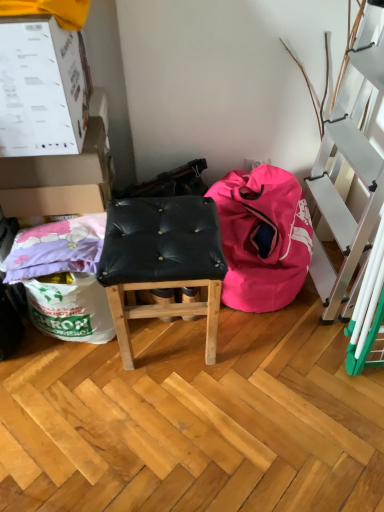
Image resolution: width=384 pixels, height=512 pixels. In order to click on white cardboard box at upper left, the 2th box viewed from the front in this screenshot , I will do `click(58, 180)`.

The height and width of the screenshot is (512, 384). What are the coordinates of `white cardboard box at upper left, the 2th box when ordered from back to front` in the screenshot? It's located at (42, 88).

What do you see at coordinates (262, 237) in the screenshot?
I see `pink fabric bean bag at lower right` at bounding box center [262, 237].

Locate an element on the screen. This screenshot has width=384, height=512. white cardboard box at upper left, the 2th box viewed from the front is located at coordinates (58, 180).

Is pink fabric bean bag at lower right touching white cardboard box at upper left, the 1th box from the back?

pink fabric bean bag at lower right and white cardboard box at upper left, the 1th box from the back, are clearly separated.

Which object is positioned more to the right, pink fabric bean bag at lower right or white cardboard box at upper left, the 2th box viewed from the front?

pink fabric bean bag at lower right.

Who is smaller, pink fabric bean bag at lower right or white cardboard box at upper left, the 2th box viewed from the front?

Smaller between the two is white cardboard box at upper left, the 2th box viewed from the front.

Could you tell me if pink fabric bean bag at lower right is facing white cardboard box at upper left, the 2th box viewed from the front?

No, pink fabric bean bag at lower right is not facing towards white cardboard box at upper left, the 2th box viewed from the front.

Considering the positions of points (52, 162) and (170, 265), is point (52, 162) closer to camera compared to point (170, 265)?

No.

Identify the location of the 1st box counting from the left of the black leather stool at center. (58, 180).

Between white cardboard box at upper left, the 2th box viewed from the front, and black leather stool at center, which one has more height?

With more height is black leather stool at center.

How different are the orientations of white cardboard box at upper left, the 2th box viewed from the front, and black leather stool at center in degrees?

1.64 degrees.

Where is `box that is the 1st object to the left of the pink fabric bean bag at lower right, starting at the anchor`? box that is the 1st object to the left of the pink fabric bean bag at lower right, starting at the anchor is located at coordinates (58, 180).

Would you say white cardboard box at upper left, the 1th box from the back, is outside pink fabric bean bag at lower right?

Absolutely, white cardboard box at upper left, the 1th box from the back, is external to pink fabric bean bag at lower right.

Considering the positions of point (43, 204) and point (233, 274), is point (43, 204) closer or farther from the camera than point (233, 274)?

Point (43, 204) is positioned closer to the camera compared to point (233, 274).

Are white cardboard box at upper left, the 1th box from the back, and pink fabric bean bag at lower right far apart?

No, there isn't a large distance between white cardboard box at upper left, the 1th box from the back, and pink fabric bean bag at lower right.

Is black leather stool at center positioned beyond the bounds of white cardboard box at upper left, the 2th box when ordered from back to front?

Yes, black leather stool at center is outside of white cardboard box at upper left, the 2th box when ordered from back to front.

Considering the points (170, 266) and (64, 130), which point is in front, point (170, 266) or point (64, 130)?

Point (170, 266)

Is black leather stool at center in front of or behind white cardboard box at upper left, placed as the first box when sorted from front to back, in the image?

Clearly, black leather stool at center is behind white cardboard box at upper left, placed as the first box when sorted from front to back.

Is black leather stool at center at the left side of white cardboard box at upper left, the 2th box when ordered from back to front?

No, black leather stool at center is not to the left of white cardboard box at upper left, the 2th box when ordered from back to front.

Measure the distance between pink fabric bean bag at lower right and black leather stool at center.

They are 30.63 centimeters apart.

Is pink fabric bean bag at lower right thinner than black leather stool at center?

No, pink fabric bean bag at lower right is not thinner than black leather stool at center.

Is pink fabric bean bag at lower right touching black leather stool at center?

There is a gap between pink fabric bean bag at lower right and black leather stool at center.

Is pink fabric bean bag at lower right taller or shorter than black leather stool at center?

pink fabric bean bag at lower right is shorter than black leather stool at center.

Does black leather stool at center turn towards white cardboard box at upper left, the 1th box from the back?

No, black leather stool at center is not aimed at white cardboard box at upper left, the 1th box from the back.

Could you measure the distance between black leather stool at center and white cardboard box at upper left, the 1th box from the back?

12.35 inches.

Is black leather stool at center shorter than white cardboard box at upper left, the 1th box from the back?

No.

From the image's perspective, which is below, black leather stool at center or white cardboard box at upper left, the 1th box from the back?

black leather stool at center, from the image's perspective.

Would you say white cardboard box at upper left, placed as the first box when sorted from front to back, is to the left or to the right of white cardboard box at upper left, the 1th box from the back, in the picture?

In the image, white cardboard box at upper left, placed as the first box when sorted from front to back, appears on the left side of white cardboard box at upper left, the 1th box from the back.

Is white cardboard box at upper left, placed as the first box when sorted from front to back, turned away from white cardboard box at upper left, the 2th box viewed from the front?

No, white cardboard box at upper left, placed as the first box when sorted from front to back, is not facing the opposite direction of white cardboard box at upper left, the 2th box viewed from the front.

Does white cardboard box at upper left, the 2th box when ordered from back to front, have a larger size compared to white cardboard box at upper left, the 2th box viewed from the front?

Correct, white cardboard box at upper left, the 2th box when ordered from back to front, is larger in size than white cardboard box at upper left, the 2th box viewed from the front.

Considering the relative sizes of white cardboard box at upper left, placed as the first box when sorted from front to back, and white cardboard box at upper left, the 1th box from the back, in the image provided, is white cardboard box at upper left, placed as the first box when sorted from front to back, thinner than white cardboard box at upper left, the 1th box from the back,?

In fact, white cardboard box at upper left, placed as the first box when sorted from front to back, might be wider than white cardboard box at upper left, the 1th box from the back.

Identify the location of bean bag chair beneath the white cardboard box at upper left, the 2th box viewed from the front (from a real-world perspective). (262, 237).

From the black leather stool at center, count the 1st box to the left and point to it. Please provide its 2D coordinates.

[(58, 180)]

When comparing their distances from white cardboard box at upper left, the 1th box from the back, does white cardboard box at upper left, placed as the first box when sorted from front to back, or pink fabric bean bag at lower right seem closer?

The object closer to white cardboard box at upper left, the 1th box from the back, is white cardboard box at upper left, placed as the first box when sorted from front to back.

Based on their spatial positions, is white cardboard box at upper left, the 2th box when ordered from back to front, or black leather stool at center closer to pink fabric bean bag at lower right?

The object closer to pink fabric bean bag at lower right is black leather stool at center.

When comparing their distances from black leather stool at center, does white cardboard box at upper left, the 2th box when ordered from back to front, or white cardboard box at upper left, the 2th box viewed from the front, seem closer?

white cardboard box at upper left, the 2th box viewed from the front, is positioned closer to the anchor black leather stool at center.

From the image, which object appears to be nearer to black leather stool at center, pink fabric bean bag at lower right or white cardboard box at upper left, the 2th box when ordered from back to front?

pink fabric bean bag at lower right is positioned closer to the anchor black leather stool at center.

When comparing their distances from pink fabric bean bag at lower right, does white cardboard box at upper left, the 2th box viewed from the front, or white cardboard box at upper left, the 2th box when ordered from back to front, seem closer?

Based on the image, white cardboard box at upper left, the 2th box viewed from the front, appears to be nearer to pink fabric bean bag at lower right.

When comparing their distances from black leather stool at center, does white cardboard box at upper left, the 1th box from the back, or pink fabric bean bag at lower right seem closer?

pink fabric bean bag at lower right is closer to black leather stool at center.

From the image, which object appears to be farther from white cardboard box at upper left, the 1th box from the back, pink fabric bean bag at lower right or white cardboard box at upper left, placed as the first box when sorted from front to back?

pink fabric bean bag at lower right.

Based on their spatial positions, is white cardboard box at upper left, the 2th box when ordered from back to front, or pink fabric bean bag at lower right further from black leather stool at center?

The object further to black leather stool at center is white cardboard box at upper left, the 2th box when ordered from back to front.

The height and width of the screenshot is (512, 384). What are the coordinates of `stool located between white cardboard box at upper left, the 2th box viewed from the front, and pink fabric bean bag at lower right in the left-right direction` in the screenshot? It's located at (162, 260).

Identify the location of box situated between white cardboard box at upper left, the 2th box when ordered from back to front, and pink fabric bean bag at lower right from left to right. The height and width of the screenshot is (512, 384). (58, 180).

The height and width of the screenshot is (512, 384). What are the coordinates of `stool between white cardboard box at upper left, placed as the first box when sorted from front to back, and pink fabric bean bag at lower right, in the horizontal direction` in the screenshot? It's located at (162, 260).

In order to click on box between white cardboard box at upper left, the 2th box when ordered from back to front, and black leather stool at center, in the vertical direction in this screenshot , I will do `click(58, 180)`.